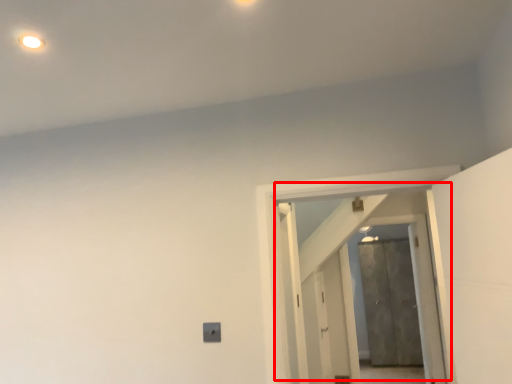
Question: From the image's perspective, what is the correct spatial relationship of door (annotated by the red box) in relation to door?

Choices:
 (A) below
 (B) above

Answer: (B)